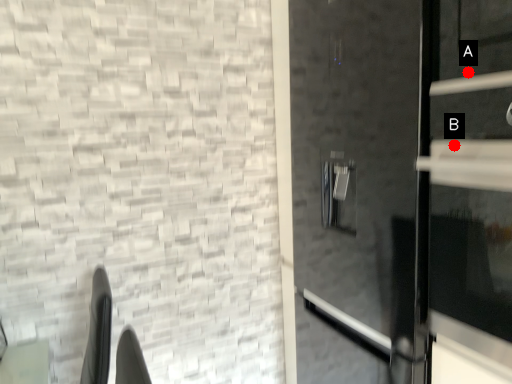
Question: Two points are circled on the image, labeled by A and B beside each circle. Which point is closer to the camera?

Choices:
 (A) A is closer
 (B) B is closer

Answer: (A)